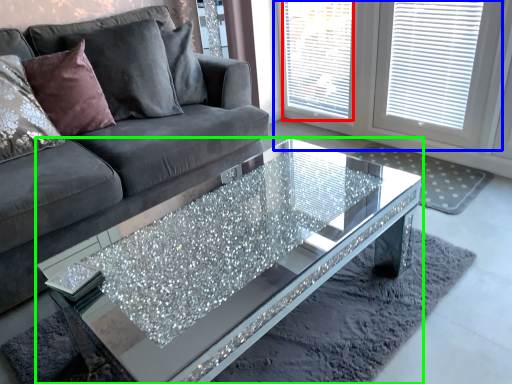
Question: Which is farther away from window screen (highlighted by a red box)? window (highlighted by a blue box) or coffee table (highlighted by a green box)?

Choices:
 (A) window
 (B) coffee table

Answer: (B)